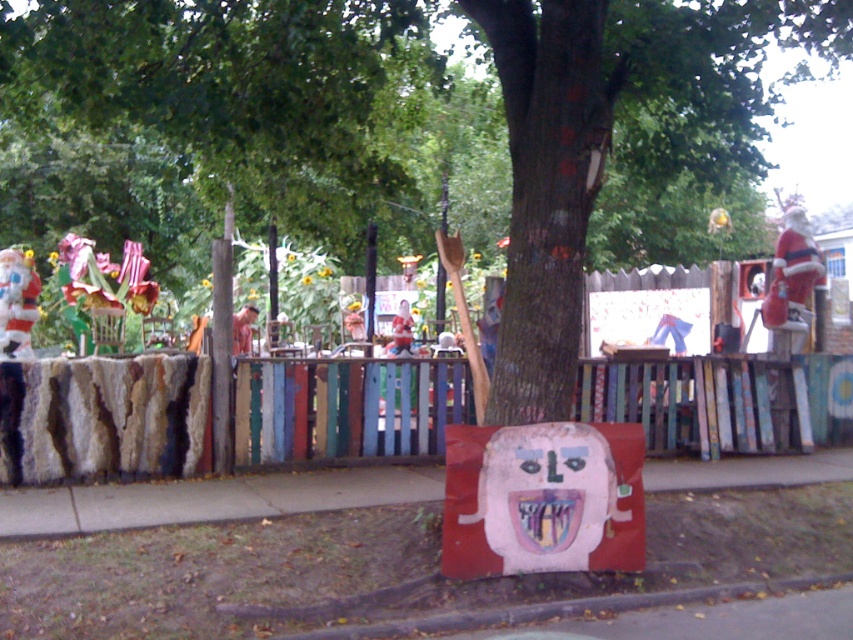
Question: Among these points, which one is farthest from the camera?

Choices:
 (A) (247, 337)
 (B) (440, 484)
 (C) (405, 321)
 (D) (209, 202)

Answer: (C)

Question: Is smooth concrete sidewalk at center above matte red santa at center?

Choices:
 (A) yes
 (B) no

Answer: (B)

Question: Is green leafy tree at center bigger than wooden figure at center?

Choices:
 (A) no
 (B) yes

Answer: (B)

Question: Based on their relative distances, which object is nearer to the wooden figure at center?

Choices:
 (A) smooth concrete sidewalk at center
 (B) green leafy tree at center

Answer: (B)

Question: Does green leafy tree at center appear under matte red santa at center?

Choices:
 (A) yes
 (B) no

Answer: (B)

Question: Which of the following is the closest to the observer?

Choices:
 (A) (289, 54)
 (B) (393, 339)

Answer: (A)